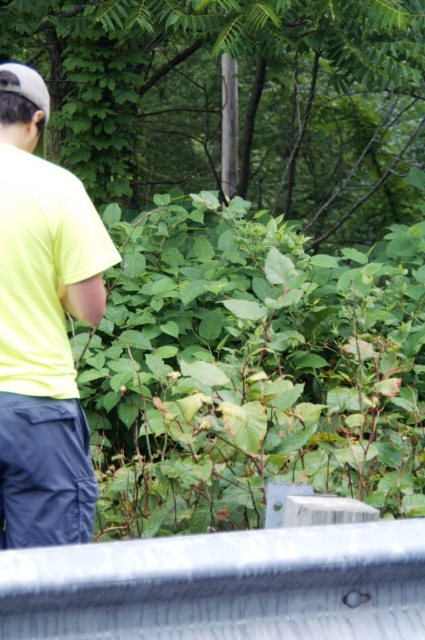
Question: Which of the following is the closest to the observer?

Choices:
 (A) metallic gray rail at lower center
 (B) yellow matte shirt at left
 (C) white matte baseball cap at upper left

Answer: (A)

Question: Is yellow matte shirt at left to the left of white matte baseball cap at upper left from the viewer's perspective?

Choices:
 (A) yes
 (B) no

Answer: (B)

Question: In this image, where is metallic gray rail at lower center located relative to yellow matte shirt at left?

Choices:
 (A) left
 (B) right

Answer: (B)

Question: Can you confirm if metallic gray rail at lower center is bigger than white matte baseball cap at upper left?

Choices:
 (A) yes
 (B) no

Answer: (A)

Question: Which object appears closest to the camera in this image?

Choices:
 (A) yellow matte shirt at left
 (B) metallic gray rail at lower center
 (C) white matte baseball cap at upper left

Answer: (B)

Question: Which point is farther from the camera taking this photo?

Choices:
 (A) (79, 246)
 (B) (147, 605)
 (C) (11, 64)

Answer: (C)